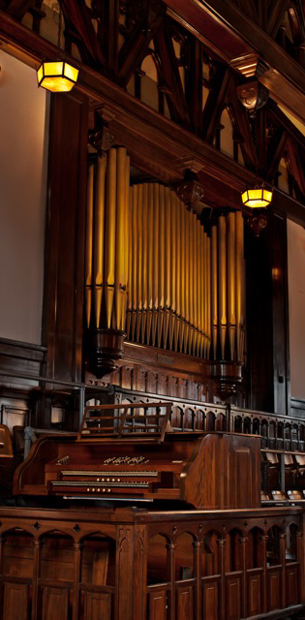
Where is `light`? light is located at coordinates (260, 198), (52, 77).